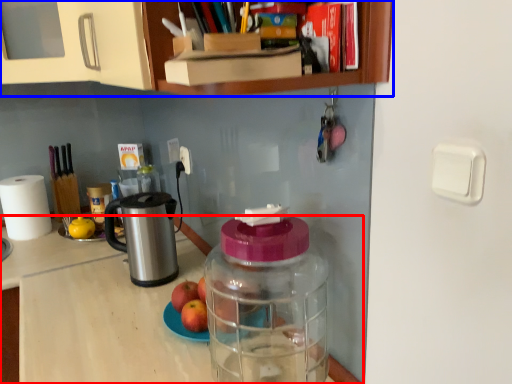
Question: Which object appears closest to the camera in this image, desk (highlighted by a red box) or cabinetry (highlighted by a blue box)?

Choices:
 (A) desk
 (B) cabinetry

Answer: (B)